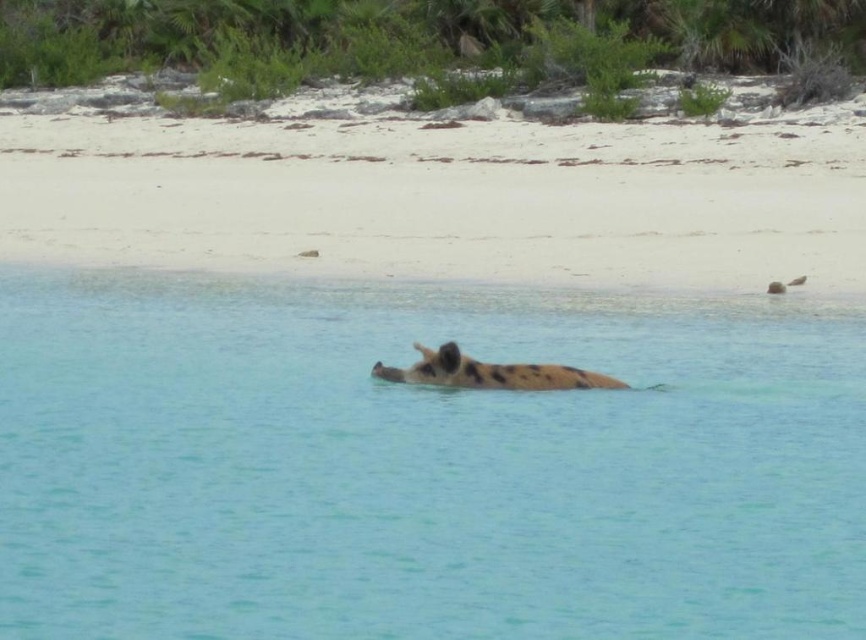
You are standing on the white sand beach at center and want to reach the spotted fur animal at center. Which direction should you move to get closer to the animal?

You should move forward because the white sand beach at center is further away from you than the spotted fur animal at center, so moving towards the animal will bring you closer.

From the picture: You are standing on the beach looking at the pig in the water. There are two points marked on the sand. The first point is at coordinates point (330, 179) and the second point is at point (385, 371). If you want to place a small flag at the point that is closer to you, which point should you choose?

You should choose point (330, 179) because it is closer to you than point (385, 371).

You are planning to build a sandcastle on the beach and need to know which area is larger. Based on the scene, which object has a larger area between the clear blue water at center and the white sand beach at center?

The white sand beach at center has a larger area than the clear blue water at center.